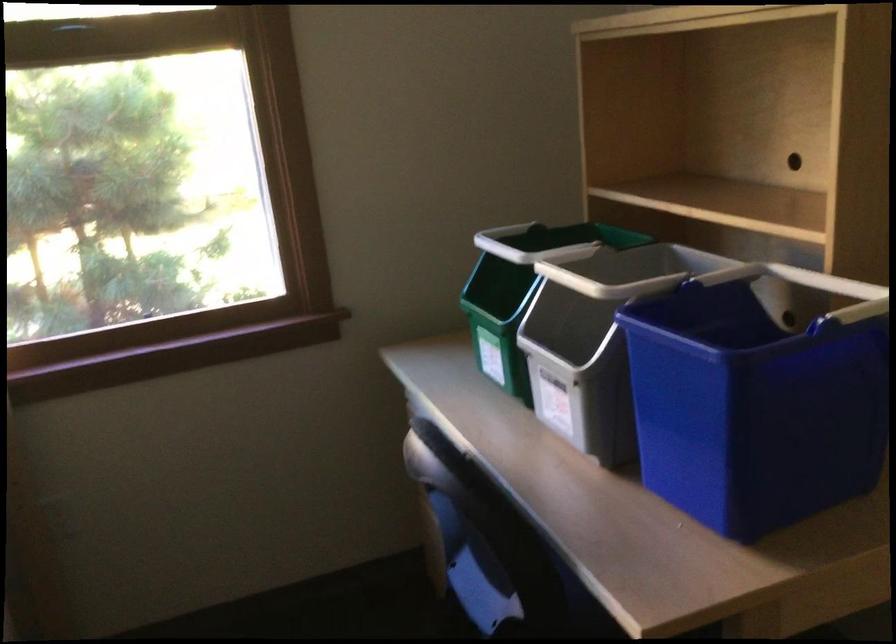
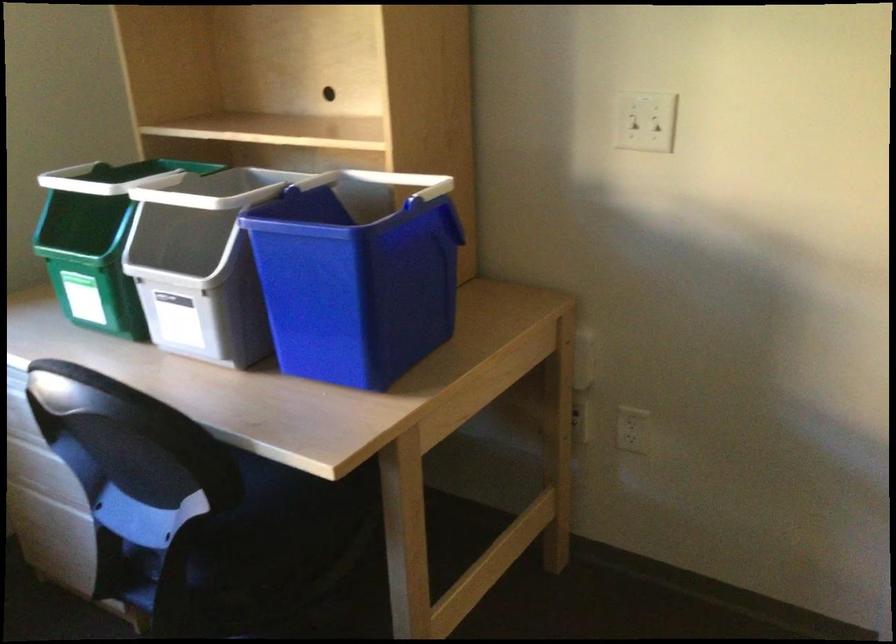
In the second image, find the point that corresponds to (546,238) in the first image.

(116, 178)